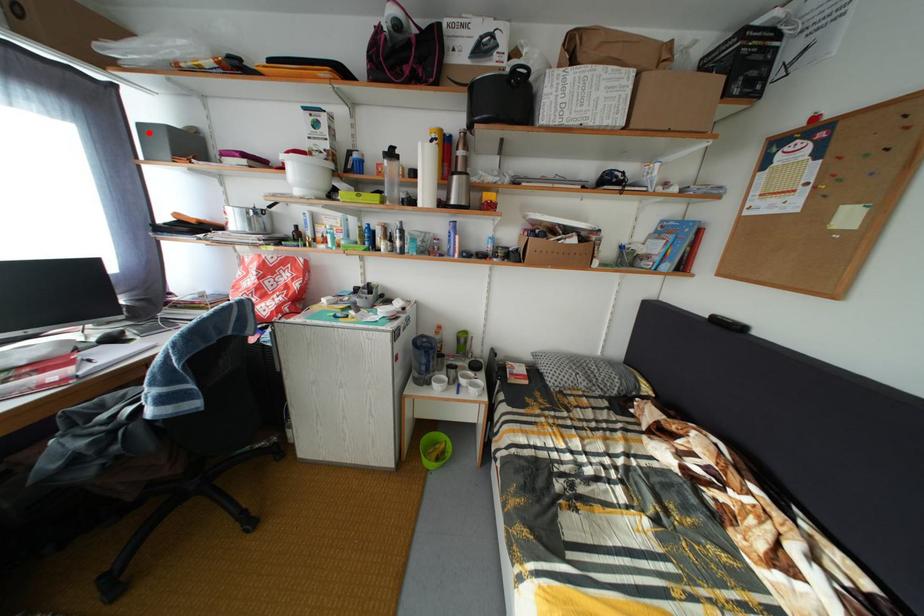
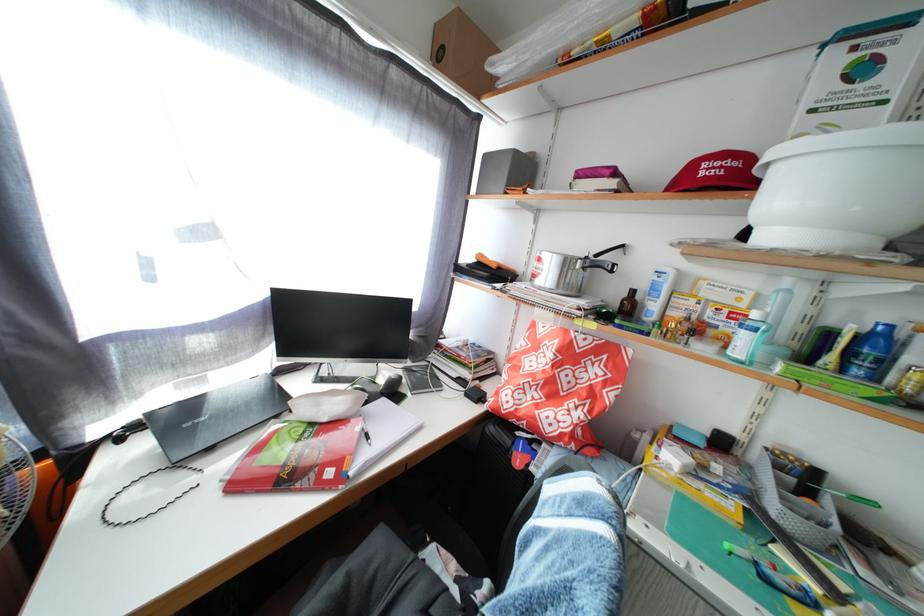
Question: A red point is marked in image1. In image2, is the corresponding 3D point closer to the camera or farther? Reply with the corresponding letter.

Choices:
 (A) The corresponding 3D point is closer.
 (B) The corresponding 3D point is farther.

Answer: (A)